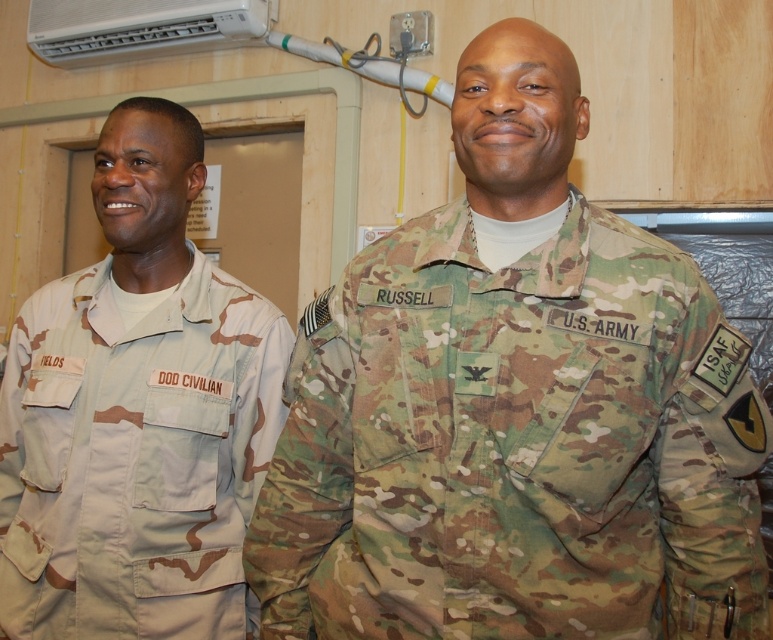
Is camo fabric us army uniform at center to the left of tan camouflage uniform at left from the viewer's perspective?

No, camo fabric us army uniform at center is not to the left of tan camouflage uniform at left.

Is camo fabric us army uniform at center below tan camouflage uniform at left?

Actually, camo fabric us army uniform at center is above tan camouflage uniform at left.

Is point (475, 182) farther from camera compared to point (155, 506)?

No.

At what (x,y) coordinates should I click in order to perform the action: click on camo fabric us army uniform at center. Please return your answer as a coordinate pair (x, y). This screenshot has height=640, width=773. Looking at the image, I should click on (513, 410).

Between tan camouflage uniform at left and white plastic air conditioner at upper center, which one is positioned higher?

white plastic air conditioner at upper center

Is tan camouflage uniform at left to the left of white plastic air conditioner at upper center from the viewer's perspective?

No, tan camouflage uniform at left is not to the left of white plastic air conditioner at upper center.

You are a GUI agent. You are given a task and a screenshot of the screen. Output one action in this format:
    pyautogui.click(x=<x>, y=<y>)
    Task: Click on the tan camouflage uniform at left
    Image resolution: width=773 pixels, height=640 pixels.
    Given the screenshot: What is the action you would take?
    pyautogui.click(x=138, y=413)

Consider the image. How far apart are camo fabric us army uniform at center and white plastic air conditioner at upper center?

camo fabric us army uniform at center is 1.85 meters from white plastic air conditioner at upper center.

Is camo fabric us army uniform at center smaller than white plastic air conditioner at upper center?

No.

Where is `camo fabric us army uniform at center`? The width and height of the screenshot is (773, 640). camo fabric us army uniform at center is located at coordinates (513, 410).

What are the coordinates of `camo fabric us army uniform at center` in the screenshot? It's located at (513, 410).